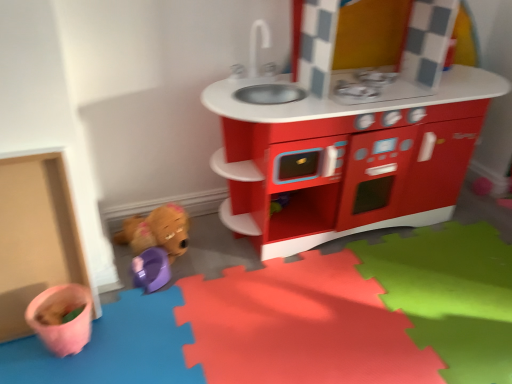
Question: Looking at their shapes, would you say matte plastic play kitchen at center is wider or thinner than purple plastic toy at lower left, which ranks as the first toy in bottom-to-top order?

Choices:
 (A) thin
 (B) wide

Answer: (B)

Question: Is matte plastic play kitchen at center taller or shorter than purple plastic toy at lower left, which ranks as the first toy in bottom-to-top order?

Choices:
 (A) tall
 (B) short

Answer: (A)

Question: Estimate the real-world distances between objects in this image. Which object is closer to the matte plastic play kitchen at center?

Choices:
 (A) brown plush toy at lower left, arranged as the second toy when ordered from the bottom
 (B) purple plastic toy at lower left, which ranks as the first toy in bottom-to-top order

Answer: (A)

Question: Which of these objects is positioned farthest from the purple plastic toy at lower left, which ranks as the first toy in bottom-to-top order?

Choices:
 (A) brown plush toy at lower left, arranged as the second toy when ordered from the bottom
 (B) matte plastic play kitchen at center

Answer: (B)